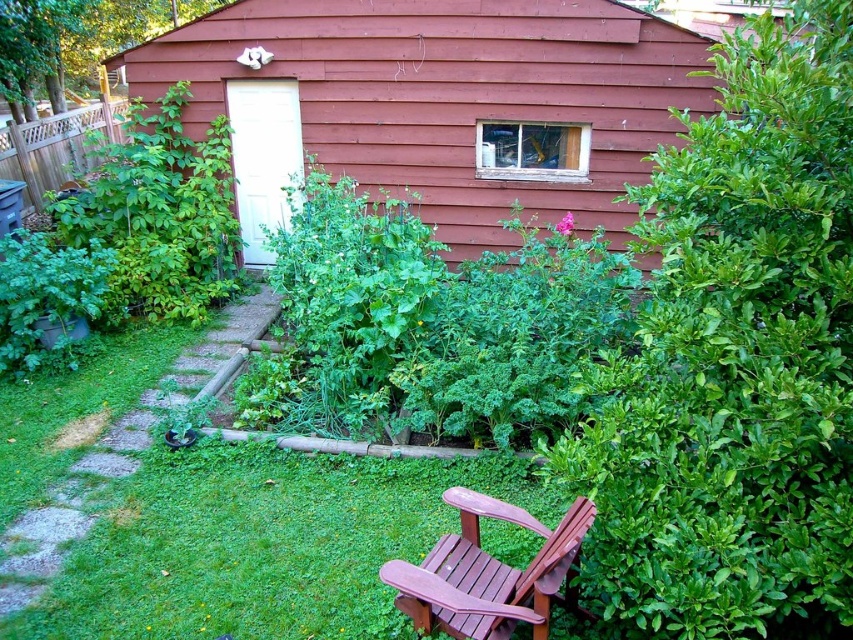
Does wooden shed at center appear on the right side of mahogany wood chair at lower center?

Incorrect, wooden shed at center is not on the right side of mahogany wood chair at lower center.

Between wooden shed at center and mahogany wood chair at lower center, which one appears on the right side from the viewer's perspective?

mahogany wood chair at lower center is more to the right.

Which is in front, point (421, 8) or point (537, 637)?

Positioned in front is point (537, 637).

Locate an element on the screen. Image resolution: width=853 pixels, height=640 pixels. wooden shed at center is located at coordinates (440, 100).

Is green leafy hedge at right positioned behind green leafy bush at left?

That is False.

Is green leafy hedge at right above green leafy bush at left?

Incorrect, green leafy hedge at right is not positioned above green leafy bush at left.

From the picture: Measure the distance between green leafy hedge at right and camera.

green leafy hedge at right and camera are 1.85 meters apart from each other.

Identify the location of green leafy hedge at right. (735, 362).

Can you confirm if wooden shed at center is taller than green leafy bush at left?

No, wooden shed at center is not taller than green leafy bush at left.

Does wooden shed at center appear on the right side of green leafy bush at left?

Indeed, wooden shed at center is positioned on the right side of green leafy bush at left.

Identify the location of wooden shed at center. (440, 100).